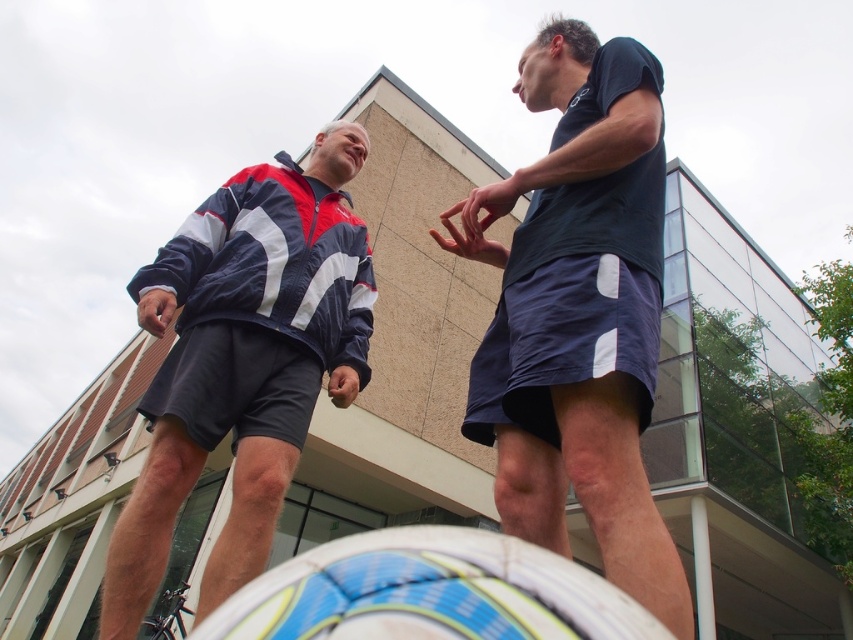
You are a photographer trying to capture both the blue and white striped jacket at upper left and the blue textured soccer ball at lower center in a single shot. Based on their sizes, which object should you focus on first to ensure both are in frame?

The blue and white striped jacket at upper left is larger in size compared to the blue textured soccer ball at lower center. To ensure both are in frame, focus on the larger object first as it requires more space in the composition.

You are a photographer trying to capture a photo of the blue textured soccer ball at lower center. To ensure the blue and white striped jacket at upper left does not block the soccer ball in the shot, should you move the camera to the right or left?

The blue and white striped jacket at upper left is positioned on the left side of the blue textured soccer ball at lower center. To avoid blocking the soccer ball, move the camera to the left so the jacket moves out of the frame to the left side.

You are a photographer standing at the lower center of the image, holding a camera. You want to capture a photo of the blue and white striped jacket at upper left without the blue textured soccer ball at lower center appearing in the frame. Is the distance between them sufficient for you to position yourself so that the soccer ball is out of the shot?

The distance between the blue and white striped jacket at upper left and the blue textured soccer ball at lower center is 26.53 inches. Since you are positioned at the lower center near the soccer ball, you can move slightly backward or to the side to frame the jacket without including the soccer ball in the shot.